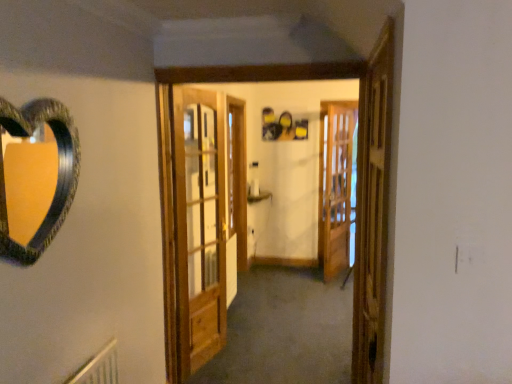
This screenshot has width=512, height=384. What are the coordinates of `free location in front of wooden screen door at center, acting as the 2th screen door starting from the left` in the screenshot? It's located at (327, 284).